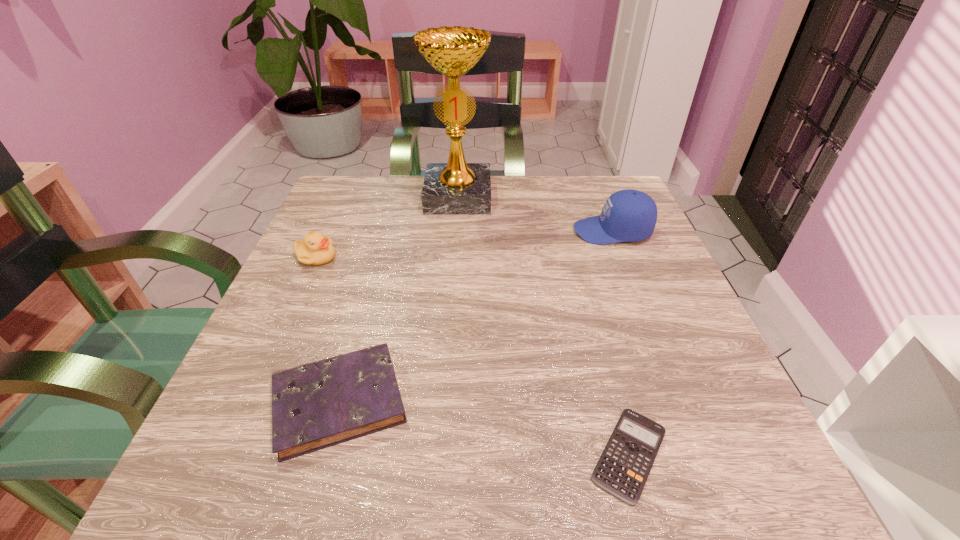
Find the location of a particular element. Image resolution: width=960 pixels, height=540 pixels. vacant area that lies between the third tallest object and the award is located at coordinates (387, 227).

Identify the location of object that is the third closest to the farthest object. (317, 405).

Choose which object is the nearest neighbor to the diary. Please provide its 2D coordinates. Your answer should be formatted as a tuple, i.e. [(x, y)], where the tuple contains the x and y coordinates of a point satisfying the conditions above.

[(315, 249)]

I want to click on free spot that satisfies the following two spatial constraints: 1. at the face of the shortest object; 2. on the left side of the third shortest object, so click(x=228, y=454).

Locate an element on the screen. free space that satisfies the following two spatial constraints: 1. at the face of the duckling; 2. on the right side of the shortest object is located at coordinates (228, 454).

Identify the location of vacant region that satisfies the following two spatial constraints: 1. at the face of the third shortest object; 2. on the right side of the calculator. coord(228,454).

This screenshot has width=960, height=540. I want to click on vacant space that satisfies the following two spatial constraints: 1. at the face of the third shortest object; 2. on the left side of the fourth tallest object, so click(251, 401).